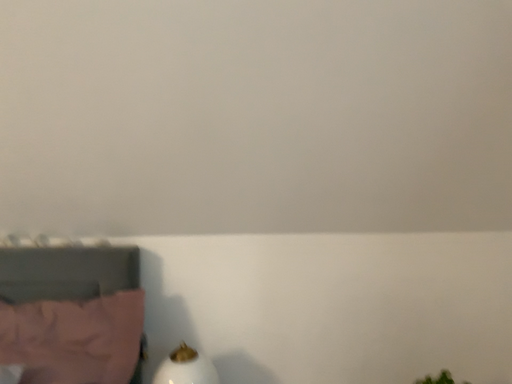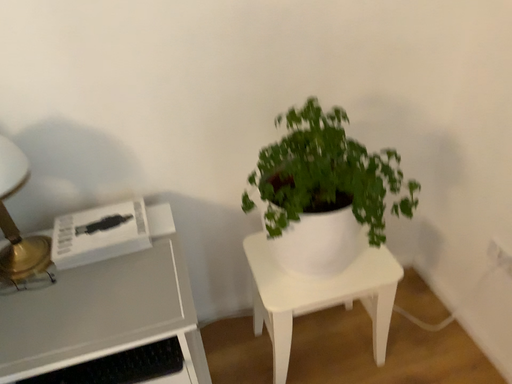
Question: Which way did the camera rotate in the video?

Choices:
 (A) rotated downward
 (B) rotated upward

Answer: (A)